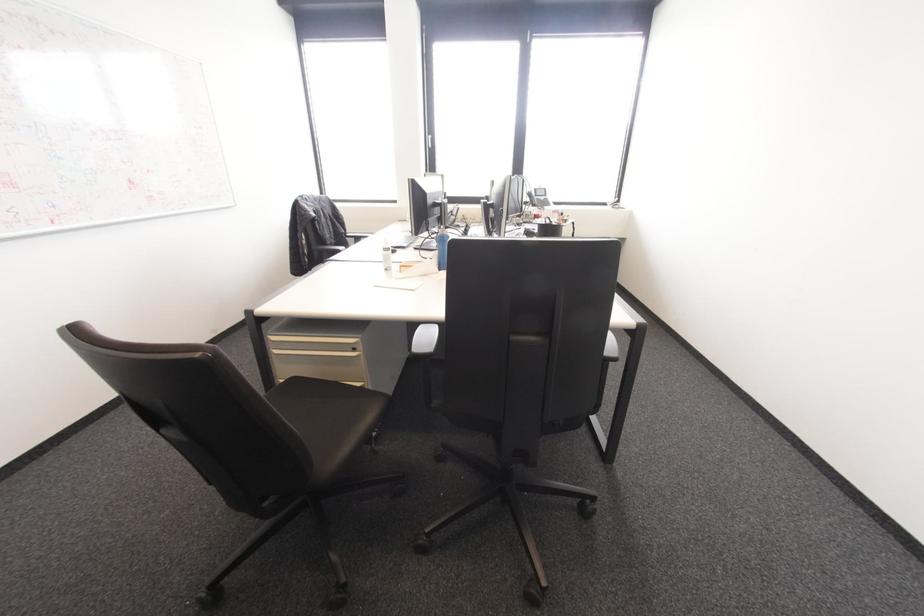
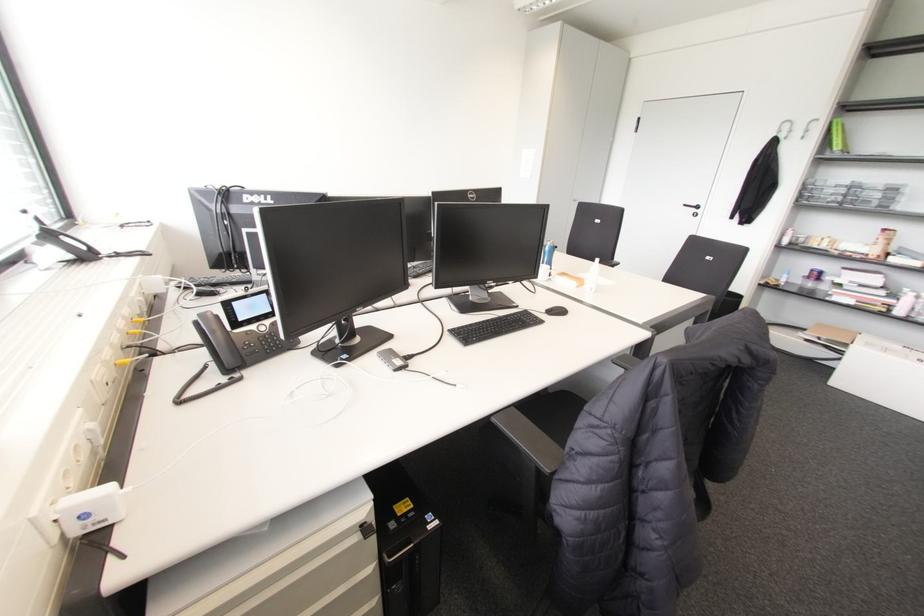
Question: I am providing you with two images of the same scene from different viewpoints. Which of the following objects are not visible in image2?

Choices:
 (A) black lid handle
 (B) cabinet drawer handle
 (C) black keyboard
 (D) metal wall hook

Answer: (B)